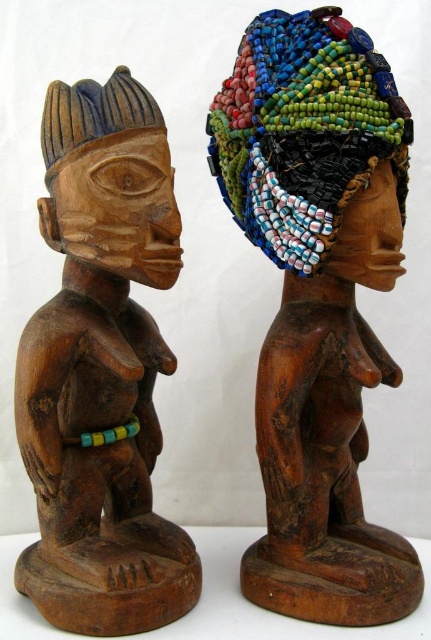
Question: Is beaded wood statue at center positioned behind wooden statue at center?

Choices:
 (A) no
 (B) yes

Answer: (B)

Question: Is wooden statue at center smaller than beaded/multicolored headdress at upper right?

Choices:
 (A) no
 (B) yes

Answer: (A)

Question: Which object is positioned farthest from the wooden statue at center?

Choices:
 (A) beaded/multicolored headdress at upper right
 (B) wooden carving at left

Answer: (A)

Question: Can you confirm if beaded/multicolored headdress at upper right is bigger than wooden carving at left?

Choices:
 (A) no
 (B) yes

Answer: (B)

Question: Among these points, which one is farthest from the camera?

Choices:
 (A) (261, 189)
 (B) (399, 148)
 (C) (90, 128)
 (D) (68, 115)

Answer: (A)

Question: Which of the following is the closest to the observer?

Choices:
 (A) (302, 188)
 (B) (178, 568)
 (C) (302, 394)
 (D) (124, 164)

Answer: (D)